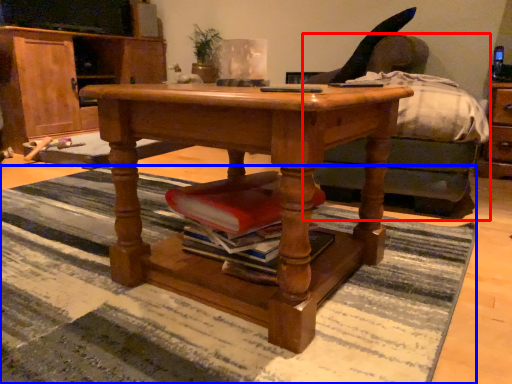
Question: Which object appears farthest to the camera in this image, studio couch (highlighted by a red box) or mat (highlighted by a blue box)?

Choices:
 (A) studio couch
 (B) mat

Answer: (A)